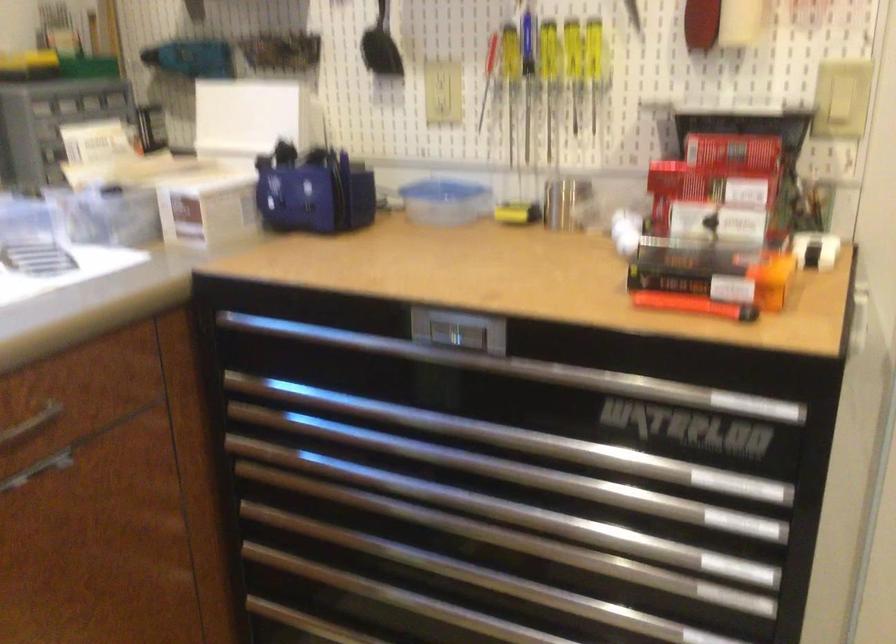
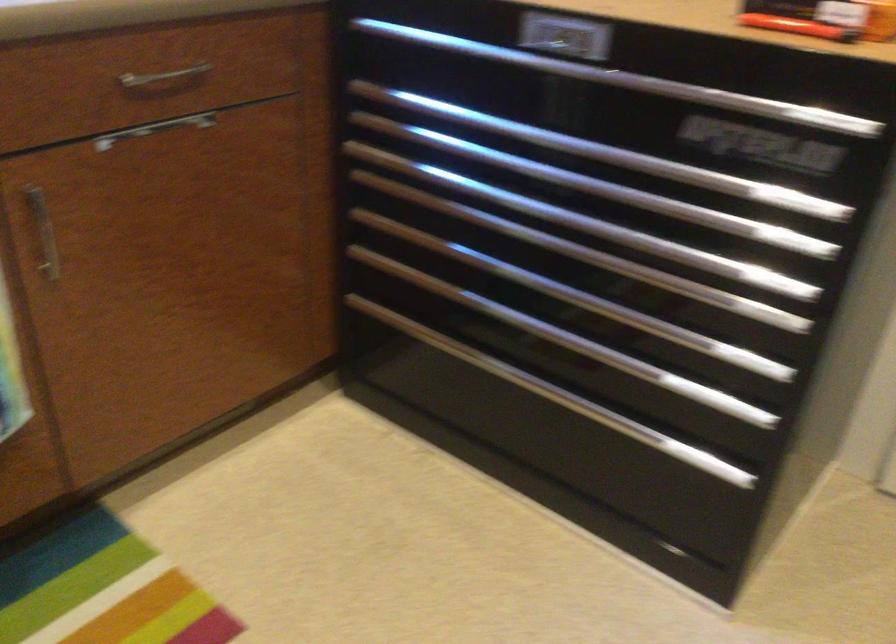
The point at [698,305] is marked in the first image. Where is the corresponding point in the second image?

(797, 26)